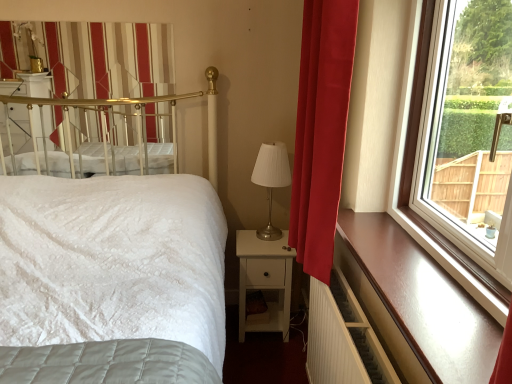
Question: Relative to gold metallic canopy bed at upper left, is brown polished wood ledge at right in front or behind?

Choices:
 (A) behind
 (B) front

Answer: (B)

Question: From a real-world perspective, is brown polished wood ledge at right physically located above or below gold metallic canopy bed at upper left?

Choices:
 (A) above
 (B) below

Answer: (B)

Question: Estimate the real-world distances between objects in this image. Which object is farther from the brown polished wood ledge at right?

Choices:
 (A) gold metallic canopy bed at upper left
 (B) white matte nightstand at center
 (C) metallic silver table lamp at center
 (D) white glossy radiator at lower right
 (E) red velvet curtain at right

Answer: (A)

Question: Which object is positioned closest to the gold metallic canopy bed at upper left?

Choices:
 (A) brown polished wood ledge at right
 (B) white glossy radiator at lower right
 (C) metallic silver table lamp at center
 (D) white matte nightstand at center
 (E) red velvet curtain at right

Answer: (C)